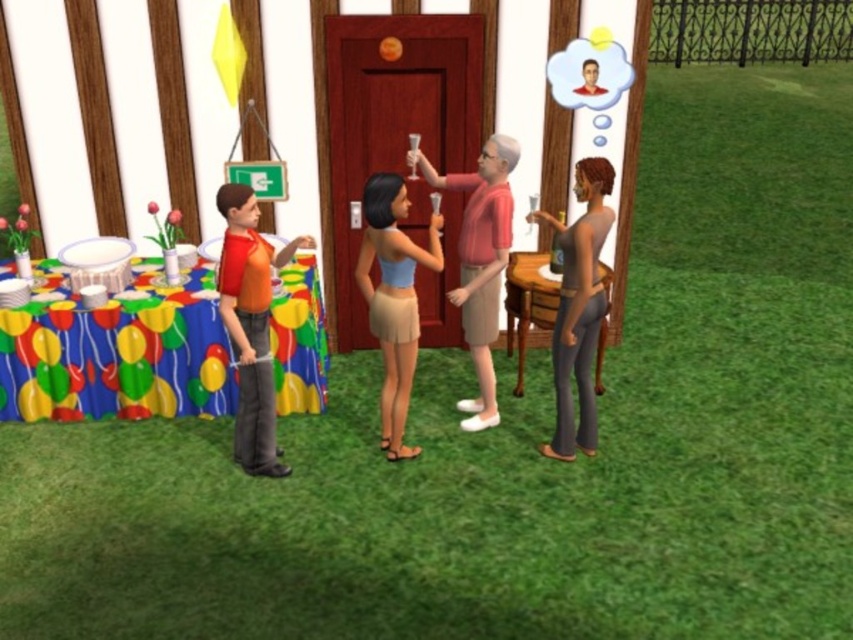
You are a guest at the party and want to find out which clothing item is shorter between the light blue fabric top at center and the matte pink shirt at center. Which one should you point out?

The light blue fabric top at center is shorter than the matte pink shirt at center, so you should point out the light blue fabric top at center.

You are attending a party and see two people wearing the light blue fabric top at center and the matte pink shirt at center. Which clothing item is closer to the ground?

The light blue fabric top at center is positioned under the matte pink shirt at center, so it is closer to the ground.

In the scene shown: You are standing at the center of the image and want to find the orange shirt at left. Which direction should you look to locate it?

The orange shirt at left is located at the left side of the image, so you should look to your left to find it.